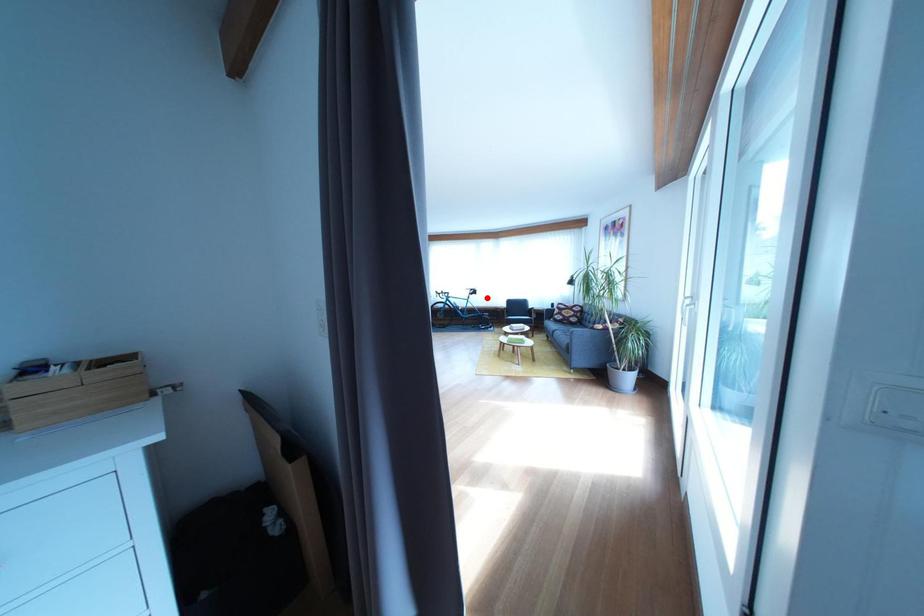
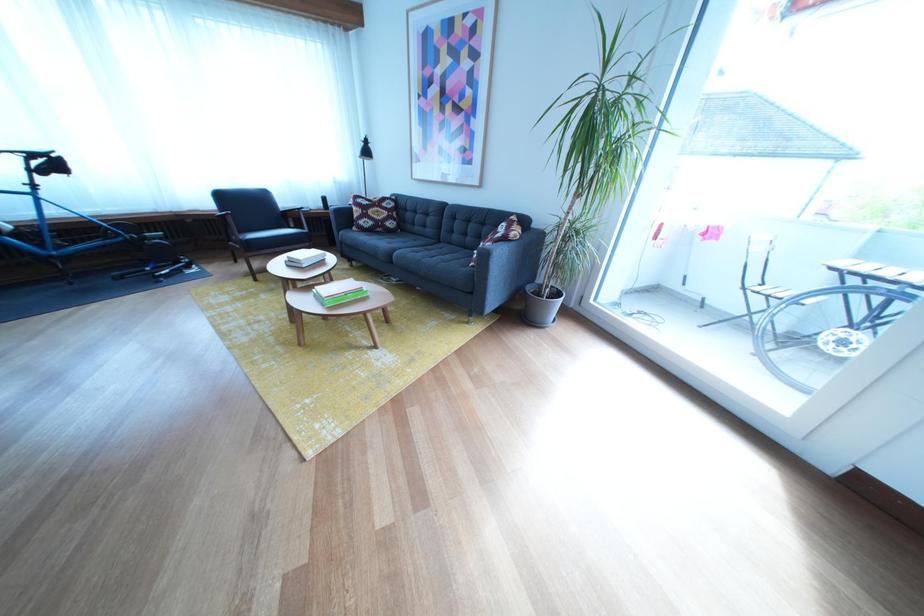
Where in the second image is the point corresponding to the highlighted location from the first image?

(64, 169)